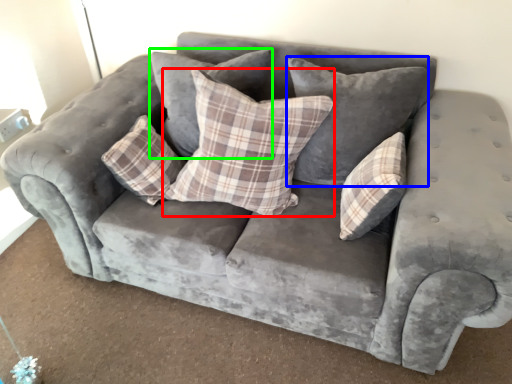
Question: Which object is the closest to the pillow (highlighted by a red box)? Choose among these: pillow (highlighted by a blue box) or pillow (highlighted by a green box).

Choices:
 (A) pillow
 (B) pillow

Answer: (A)